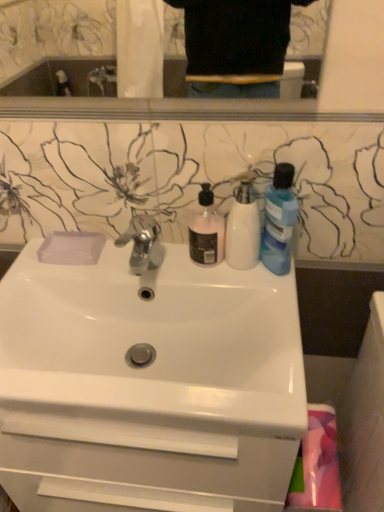
Identify the location of free location in front of blue translucent bottle at upper right, which is counted as the 3th cleaning product, starting from the left. (276, 307).